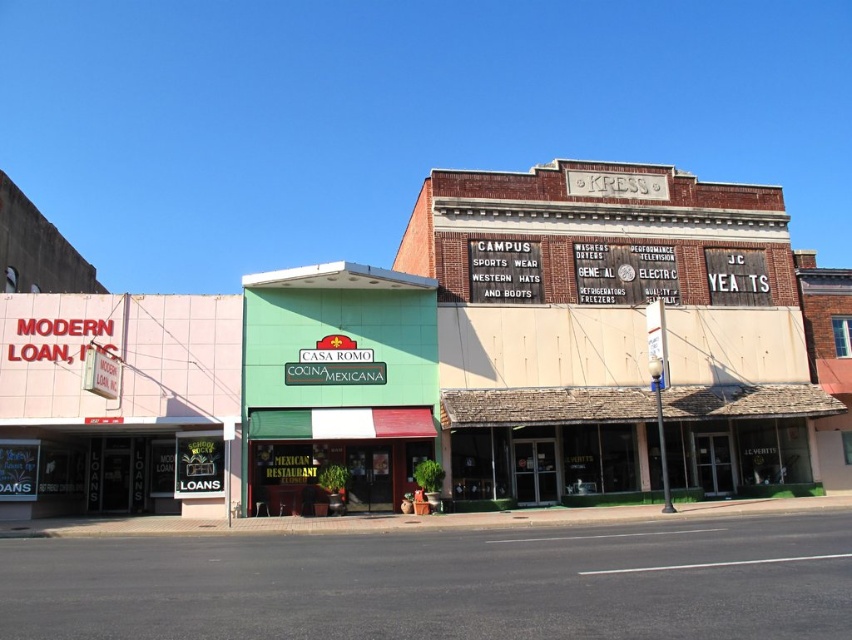
Question: Does green painted building at center have a larger size compared to green matte signboard at center?

Choices:
 (A) yes
 (B) no

Answer: (A)

Question: Which point is closer to the camera?

Choices:
 (A) green matte signboard at center
 (B) green painted building at center

Answer: (B)

Question: Which point is closer to the camera?

Choices:
 (A) (395, 401)
 (B) (816, 337)

Answer: (A)

Question: Is green painted building at center positioned at the back of green matte signboard at center?

Choices:
 (A) no
 (B) yes

Answer: (A)

Question: Where is green painted building at center located in relation to green matte signboard at center in the image?

Choices:
 (A) left
 (B) right

Answer: (B)